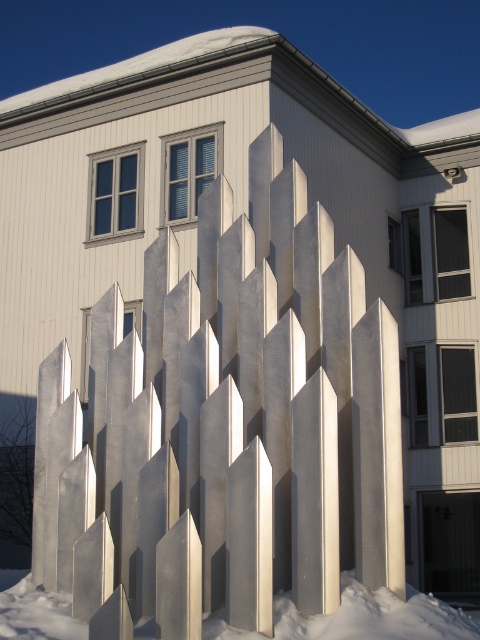
Question: In this image, where is metallic silver fence at center located relative to white powdery snow at lower center?

Choices:
 (A) above
 (B) below

Answer: (A)

Question: In this image, where is metallic silver fence at center located relative to white powdery snow at lower center?

Choices:
 (A) above
 (B) below

Answer: (A)

Question: Is metallic silver fence at center above white powdery snow at lower center?

Choices:
 (A) yes
 (B) no

Answer: (A)

Question: Which point appears farthest from the camera in this image?

Choices:
 (A) (99, 625)
 (B) (38, 636)

Answer: (B)

Question: Which point is closer to the camera taking this photo?

Choices:
 (A) (142, 456)
 (B) (468, 632)

Answer: (B)

Question: Among these points, which one is nearest to the camera?

Choices:
 (A) (188, 500)
 (B) (389, 616)

Answer: (B)